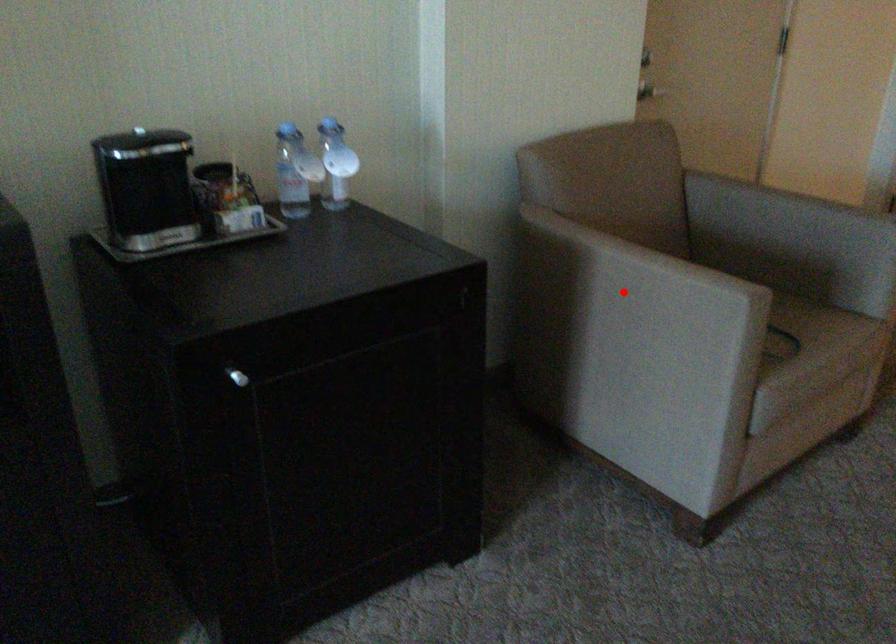
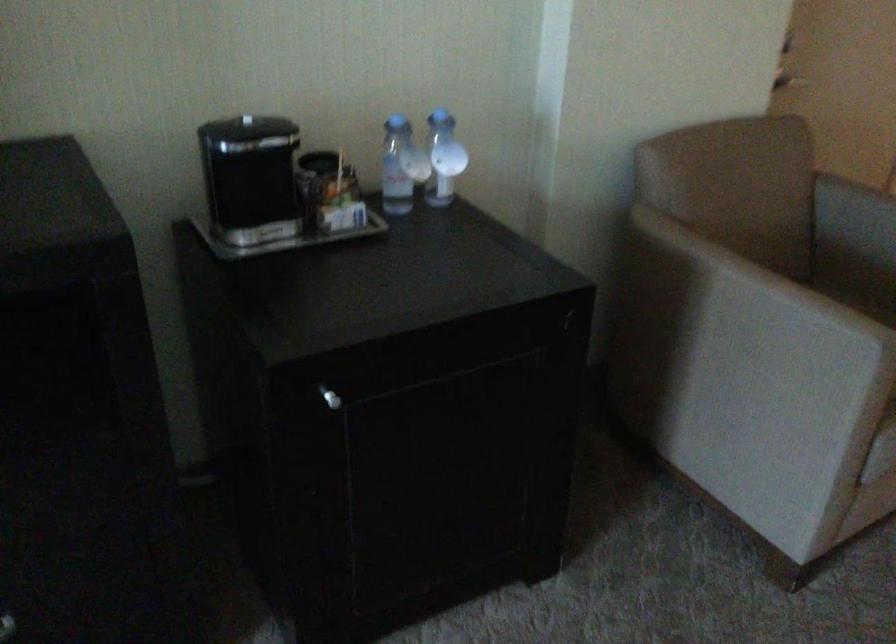
In the second image, find the point that corresponds to the highlighted location in the first image.

(739, 319)